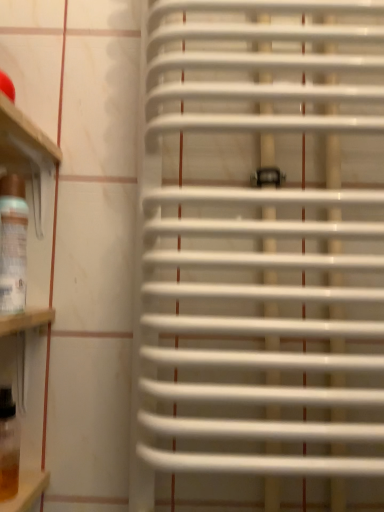
What do you see at coordinates (13, 244) in the screenshot?
I see `translucent glass wine bottle at left, which is counted as the 2th wine bottle, starting from the bottom` at bounding box center [13, 244].

This screenshot has width=384, height=512. What are the coordinates of `translucent amber glass at lower left, placed as the first wine bottle when sorted from bottom to top` in the screenshot? It's located at (8, 445).

At what (x,y) coordinates should I click in order to perform the action: click on translucent glass wine bottle at left, the first wine bottle when ordered from top to bottom. Please return your answer as a coordinate pair (x, y). The image size is (384, 512). Looking at the image, I should click on (13, 244).

In the scene shown: From the image's perspective, does translucent amber glass at lower left, placed as the first wine bottle when sorted from bottom to top, appear lower than translucent glass wine bottle at left, the first wine bottle when ordered from top to bottom?

Yes.

How many degrees apart are the facing directions of translucent amber glass at lower left, placed as the first wine bottle when sorted from bottom to top, and translucent glass wine bottle at left, the first wine bottle when ordered from top to bottom?

translucent amber glass at lower left, placed as the first wine bottle when sorted from bottom to top, and translucent glass wine bottle at left, the first wine bottle when ordered from top to bottom, are facing 0.000314 degrees away from each other.

Is translucent amber glass at lower left, the 2th wine bottle viewed from the top, positioned in front of translucent glass wine bottle at left, which is counted as the 2th wine bottle, starting from the bottom?

No, translucent amber glass at lower left, the 2th wine bottle viewed from the top, is further to the viewer.

Is translucent amber glass at lower left, the 2th wine bottle viewed from the top, not near translucent glass wine bottle at left, the first wine bottle when ordered from top to bottom?

Actually, translucent amber glass at lower left, the 2th wine bottle viewed from the top, and translucent glass wine bottle at left, the first wine bottle when ordered from top to bottom, are a little close together.

Which object is more forward, translucent glass wine bottle at left, which is counted as the 2th wine bottle, starting from the bottom, or white plastic radiator at center?

white plastic radiator at center is in front.

Consider the image. Would you say translucent glass wine bottle at left, the first wine bottle when ordered from top to bottom, is inside or outside white plastic radiator at center?

translucent glass wine bottle at left, the first wine bottle when ordered from top to bottom, is spatially situated outside white plastic radiator at center.

Considering the relative sizes of translucent glass wine bottle at left, which is counted as the 2th wine bottle, starting from the bottom, and white plastic radiator at center in the image provided, is translucent glass wine bottle at left, which is counted as the 2th wine bottle, starting from the bottom, shorter than white plastic radiator at center?

Yes.

Which is in front, point (2, 216) or point (216, 112)?

The point (2, 216) is closer.

Considering the relative sizes of white plastic radiator at center and translucent amber glass at lower left, placed as the first wine bottle when sorted from bottom to top, in the image provided, is white plastic radiator at center taller than translucent amber glass at lower left, placed as the first wine bottle when sorted from bottom to top,?

Indeed, white plastic radiator at center has a greater height compared to translucent amber glass at lower left, placed as the first wine bottle when sorted from bottom to top.

From the image's perspective, which is above, white plastic radiator at center or translucent amber glass at lower left, the 2th wine bottle viewed from the top?

white plastic radiator at center, from the image's perspective.

Is white plastic radiator at center located outside translucent amber glass at lower left, placed as the first wine bottle when sorted from bottom to top?

Yes, white plastic radiator at center is not within translucent amber glass at lower left, placed as the first wine bottle when sorted from bottom to top.

Is translucent amber glass at lower left, the 2th wine bottle viewed from the top, at the back of white plastic radiator at center?

No.

From a real-world perspective, between translucent amber glass at lower left, the 2th wine bottle viewed from the top, and white plastic radiator at center, who is vertically lower?

translucent amber glass at lower left, the 2th wine bottle viewed from the top, from a real-world perspective.

Considering the sizes of objects translucent amber glass at lower left, placed as the first wine bottle when sorted from bottom to top, and white plastic radiator at center in the image provided, who is smaller, translucent amber glass at lower left, placed as the first wine bottle when sorted from bottom to top, or white plastic radiator at center?

With smaller size is translucent amber glass at lower left, placed as the first wine bottle when sorted from bottom to top.

Can you confirm if translucent amber glass at lower left, the 2th wine bottle viewed from the top, is thinner than white plastic radiator at center?

Indeed, translucent amber glass at lower left, the 2th wine bottle viewed from the top, has a lesser width compared to white plastic radiator at center.

Does point (2, 428) appear closer or farther from the camera than point (264, 360)?

Point (2, 428).

From the picture: How many degrees apart are the facing directions of white plastic radiator at center and translucent glass wine bottle at left, the first wine bottle when ordered from top to bottom?

0.00062 degrees separate the facing orientations of white plastic radiator at center and translucent glass wine bottle at left, the first wine bottle when ordered from top to bottom.

Is white plastic radiator at center taller than translucent glass wine bottle at left, which is counted as the 2th wine bottle, starting from the bottom?

Yes, white plastic radiator at center is taller than translucent glass wine bottle at left, which is counted as the 2th wine bottle, starting from the bottom.

Is white plastic radiator at center inside the boundaries of translucent glass wine bottle at left, the first wine bottle when ordered from top to bottom, or outside?

white plastic radiator at center exists outside the volume of translucent glass wine bottle at left, the first wine bottle when ordered from top to bottom.

Is white plastic radiator at center turned away from translucent glass wine bottle at left, which is counted as the 2th wine bottle, starting from the bottom?

No, white plastic radiator at center is not facing away from translucent glass wine bottle at left, which is counted as the 2th wine bottle, starting from the bottom.

Which object is closer to the camera, translucent glass wine bottle at left, the first wine bottle when ordered from top to bottom, or translucent amber glass at lower left, placed as the first wine bottle when sorted from bottom to top?

translucent glass wine bottle at left, the first wine bottle when ordered from top to bottom.

From the image's perspective, which object appears higher, translucent glass wine bottle at left, which is counted as the 2th wine bottle, starting from the bottom, or translucent amber glass at lower left, the 2th wine bottle viewed from the top?

translucent glass wine bottle at left, which is counted as the 2th wine bottle, starting from the bottom, is shown above in the image.

I want to click on wine bottle on the left of translucent glass wine bottle at left, the first wine bottle when ordered from top to bottom, so click(8, 445).

Is translucent glass wine bottle at left, which is counted as the 2th wine bottle, starting from the bottom, far away from translucent amber glass at lower left, the 2th wine bottle viewed from the top?

No, translucent glass wine bottle at left, which is counted as the 2th wine bottle, starting from the bottom, is not far away from translucent amber glass at lower left, the 2th wine bottle viewed from the top.

Where is `wine bottle above the translucent amber glass at lower left, placed as the first wine bottle when sorted from bottom to top (from a real-world perspective)`? The height and width of the screenshot is (512, 384). wine bottle above the translucent amber glass at lower left, placed as the first wine bottle when sorted from bottom to top (from a real-world perspective) is located at coordinates (13, 244).

Image resolution: width=384 pixels, height=512 pixels. I want to click on wine bottle that is the 1st one when counting backward from the white plastic radiator at center, so click(x=13, y=244).

Looking at the image, which one is located closer to translucent amber glass at lower left, the 2th wine bottle viewed from the top, translucent glass wine bottle at left, the first wine bottle when ordered from top to bottom, or white plastic radiator at center?

Among the two, translucent glass wine bottle at left, the first wine bottle when ordered from top to bottom, is located nearer to translucent amber glass at lower left, the 2th wine bottle viewed from the top.

Looking at the image, which one is located further to translucent glass wine bottle at left, which is counted as the 2th wine bottle, starting from the bottom, white plastic radiator at center or translucent amber glass at lower left, the 2th wine bottle viewed from the top?

white plastic radiator at center lies further to translucent glass wine bottle at left, which is counted as the 2th wine bottle, starting from the bottom, than the other object.

Which object lies further to the anchor point translucent amber glass at lower left, placed as the first wine bottle when sorted from bottom to top, white plastic radiator at center or translucent glass wine bottle at left, which is counted as the 2th wine bottle, starting from the bottom?

white plastic radiator at center is positioned further to the anchor translucent amber glass at lower left, placed as the first wine bottle when sorted from bottom to top.

Which object lies further to the anchor point translucent glass wine bottle at left, the first wine bottle when ordered from top to bottom, translucent amber glass at lower left, placed as the first wine bottle when sorted from bottom to top, or white plastic radiator at center?

white plastic radiator at center is further to translucent glass wine bottle at left, the first wine bottle when ordered from top to bottom.

Estimate the real-world distances between objects in this image. Which object is closer to white plastic radiator at center, translucent amber glass at lower left, placed as the first wine bottle when sorted from bottom to top, or translucent glass wine bottle at left, the first wine bottle when ordered from top to bottom?

translucent glass wine bottle at left, the first wine bottle when ordered from top to bottom.

Estimate the real-world distances between objects in this image. Which object is closer to white plastic radiator at center, translucent glass wine bottle at left, the first wine bottle when ordered from top to bottom, or translucent amber glass at lower left, the 2th wine bottle viewed from the top?

translucent glass wine bottle at left, the first wine bottle when ordered from top to bottom, is positioned closer to the anchor white plastic radiator at center.

This screenshot has height=512, width=384. Identify the location of wine bottle situated between translucent amber glass at lower left, the 2th wine bottle viewed from the top, and white plastic radiator at center from left to right. (13, 244).